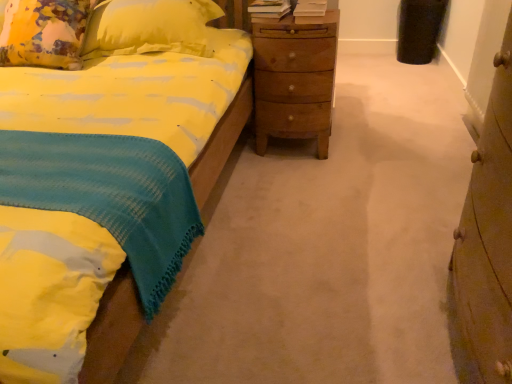
Question: Can you confirm if yellow fabric pillow at upper left is thinner than wooden chest of drawers at right?

Choices:
 (A) no
 (B) yes

Answer: (A)

Question: Considering the relative sizes of yellow fabric pillow at upper left and wooden chest of drawers at right in the image provided, is yellow fabric pillow at upper left shorter than wooden chest of drawers at right?

Choices:
 (A) yes
 (B) no

Answer: (A)

Question: Is yellow fabric pillow at upper left to the left of wooden chest of drawers at right from the viewer's perspective?

Choices:
 (A) no
 (B) yes

Answer: (B)

Question: Is yellow fabric pillow at upper left directly adjacent to wooden chest of drawers at right?

Choices:
 (A) no
 (B) yes

Answer: (A)

Question: From a real-world perspective, is yellow fabric pillow at upper left on wooden chest of drawers at right?

Choices:
 (A) no
 (B) yes

Answer: (B)

Question: Can you confirm if yellow fabric pillow at upper left is bigger than wooden chest of drawers at right?

Choices:
 (A) no
 (B) yes

Answer: (A)

Question: Is wooden chest of drawers at right positioned behind wooden nightstand at center?

Choices:
 (A) no
 (B) yes

Answer: (A)

Question: From the image's perspective, is wooden chest of drawers at right beneath wooden nightstand at center?

Choices:
 (A) yes
 (B) no

Answer: (A)

Question: From a real-world perspective, is wooden chest of drawers at right below wooden nightstand at center?

Choices:
 (A) yes
 (B) no

Answer: (B)

Question: Can you confirm if wooden chest of drawers at right is wider than wooden nightstand at center?

Choices:
 (A) no
 (B) yes

Answer: (A)

Question: From a real-world perspective, is wooden chest of drawers at right on wooden nightstand at center?

Choices:
 (A) yes
 (B) no

Answer: (A)

Question: Considering the relative sizes of wooden chest of drawers at right and wooden nightstand at center in the image provided, is wooden chest of drawers at right shorter than wooden nightstand at center?

Choices:
 (A) yes
 (B) no

Answer: (B)

Question: Is wooden nightstand at center outside of yellow fabric pillow at upper left?

Choices:
 (A) yes
 (B) no

Answer: (A)